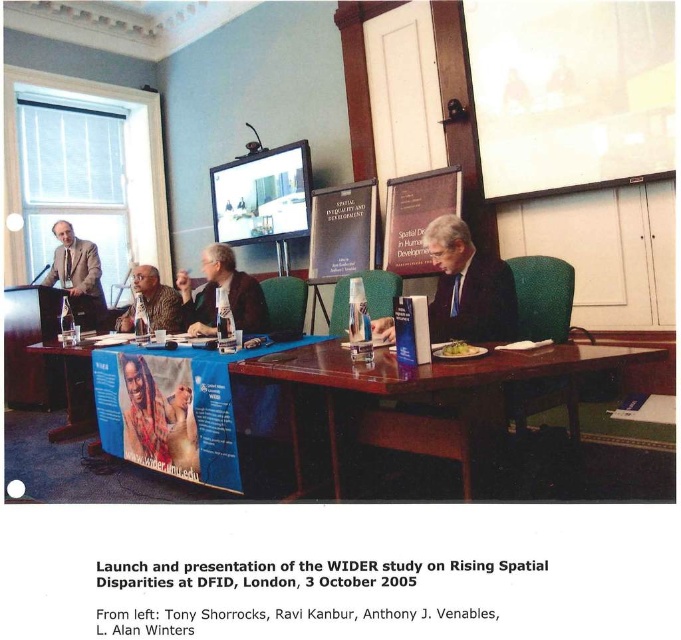
Between matte paper poster at center and matte black jacket at center, which one has less height?

matte black jacket at center is shorter.

Who is more distant from viewer, (332,211) or (189,280)?

Point (189,280)

The width and height of the screenshot is (681, 640). Identify the location of matte paper poster at center. (340, 230).

Between matte paper poster at center and matte paper banner at center, which one appears on the left side from the viewer's perspective?

matte paper poster at center is more to the left.

Between matte paper poster at center and matte paper banner at center, which one has less height?

Standing shorter between the two is matte paper banner at center.

Between point (317, 250) and point (394, 218), which one is positioned in front?

Point (394, 218) is in front.

You are a GUI agent. You are given a task and a screenshot of the screen. Output one action in this format:
    pyautogui.click(x=<x>, y=<y>)
    Task: Click on the matte paper poster at center
    This screenshot has width=681, height=640.
    Given the screenshot: What is the action you would take?
    pyautogui.click(x=340, y=230)

Who is lower down, matte paper poster at center or light brown suit at left?

light brown suit at left is below.

Who is more forward, (332,240) or (74,257)?

Point (332,240) is more forward.

You are a GUI agent. You are given a task and a screenshot of the screen. Output one action in this format:
    pyautogui.click(x=<x>, y=<y>)
    Task: Click on the matte paper poster at center
    This screenshot has height=640, width=681.
    Given the screenshot: What is the action you would take?
    pyautogui.click(x=340, y=230)